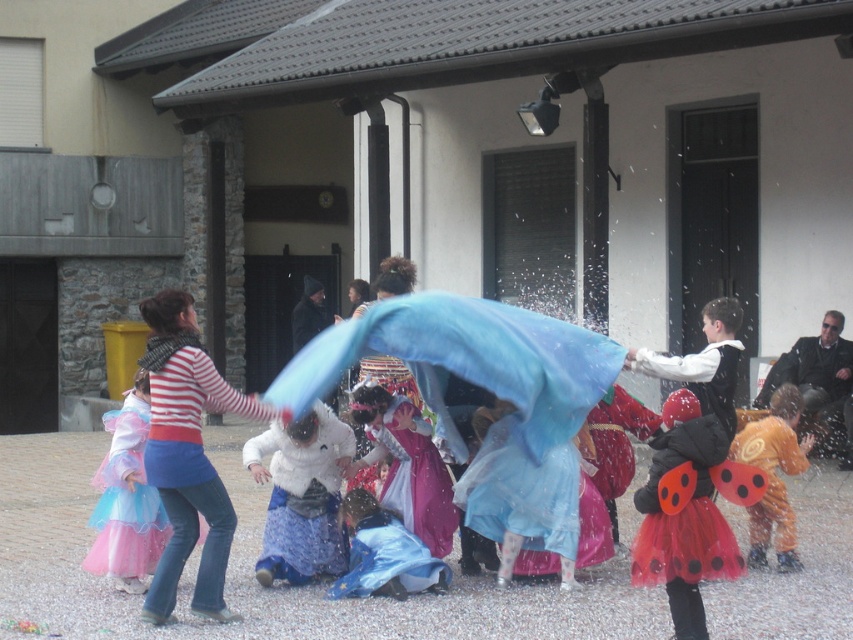
You are a photographer trying to capture both the striped cotton shirt at center and the orange fabric costume at center in a single frame. Since you can only focus on one object at a time, which one should you choose to ensure it appears larger in the photo?

The orange fabric costume at center is larger than the striped cotton shirt at center, so focusing on it will make it appear larger in the photo.

You are standing in the courtyard and want to find the striped cotton shirt at center. According to the coordinates given, where should you look relative to the image frame?

The striped cotton shirt at center is located at coordinates point 0.713 on the x axis and 0.220 on the y axis, so you should look towards the right side and lower middle area of the image frame.